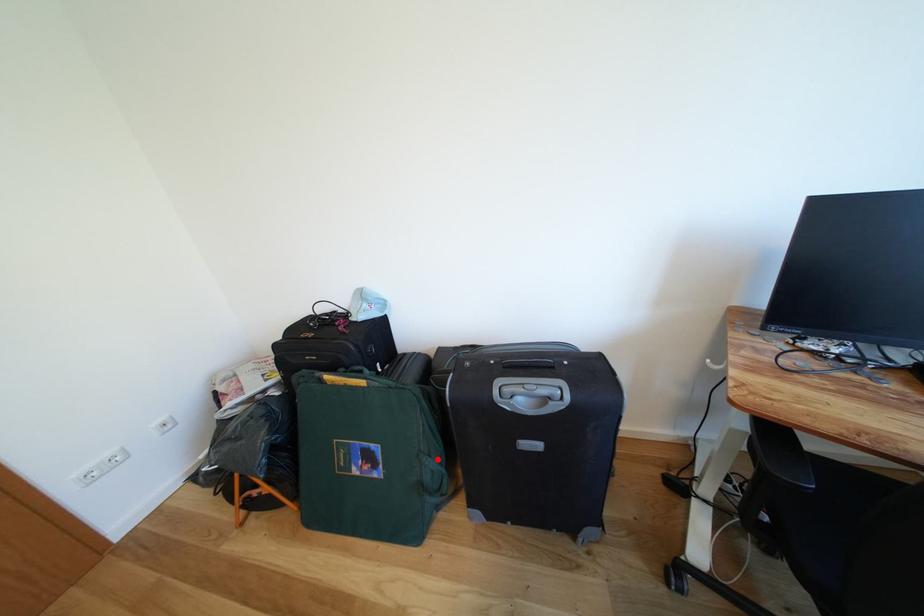
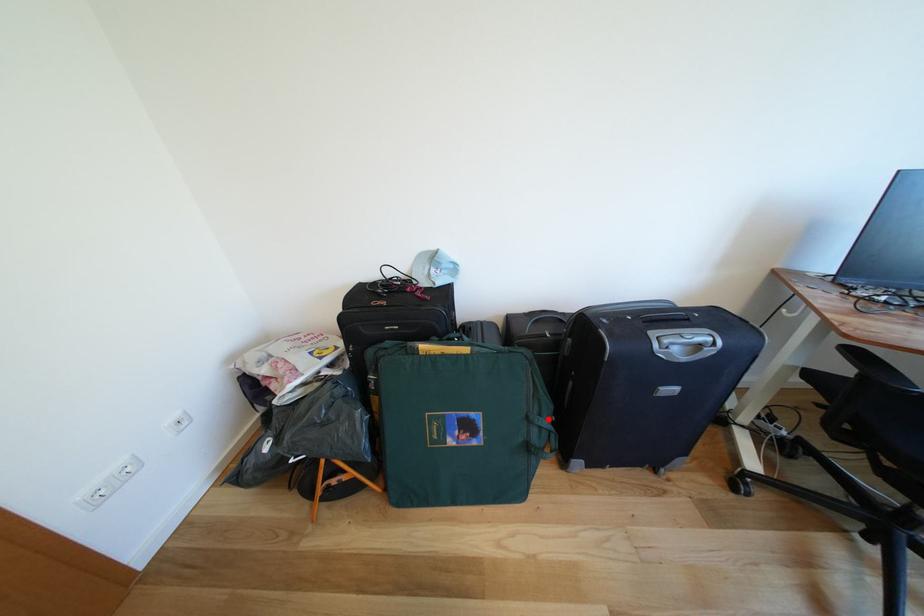
I am providing you with two images of the same scene from different viewpoints. A red point is marked on the first image and another point is marked on the second image. Is the red point in image1 aligned with the point shown in image2?

Yes